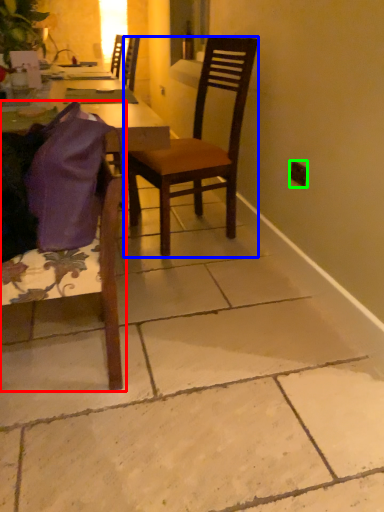
Question: Estimate the real-world distances between objects in this image. Which object is farther from chair (highlighted by a red box), chair (highlighted by a blue box) or power outlet (highlighted by a green box)?

Choices:
 (A) chair
 (B) power outlet

Answer: (B)